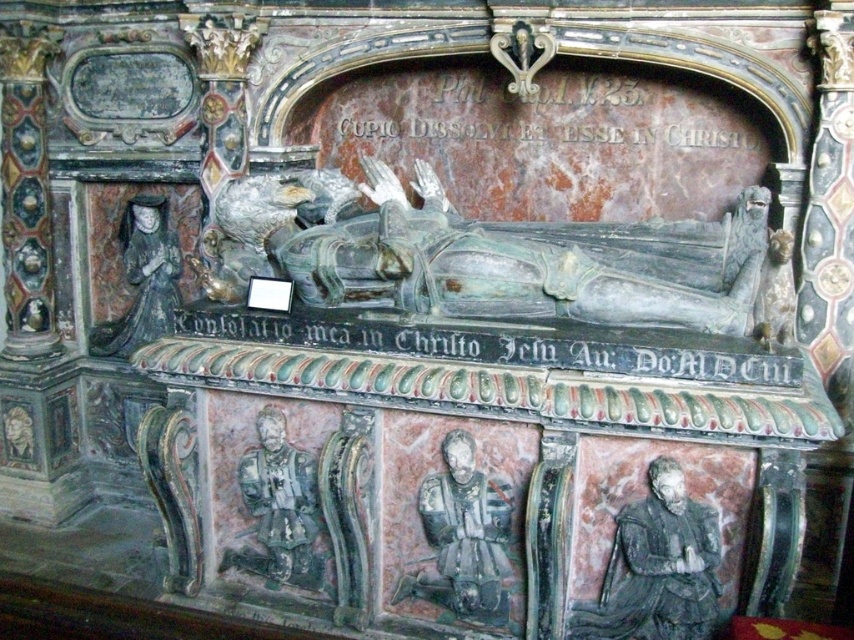
Question: Is green patinated stone figure at center in front of gray stone figure at lower right?

Choices:
 (A) yes
 (B) no

Answer: (B)

Question: Is green patinated stone figure at center in front of gray stone figure at center?

Choices:
 (A) yes
 (B) no

Answer: (B)

Question: Which object appears farthest from the camera in this image?

Choices:
 (A) gray stone figure at center
 (B) gray stone figure at lower right
 (C) green patinated stone figure at center
 (D) gray stone statue at left

Answer: (D)

Question: Which of the following is the farthest from the observer?

Choices:
 (A) (460, 305)
 (B) (278, 550)
 (C) (657, 550)
 (D) (118, 237)

Answer: (D)

Question: Which point is closer to the camera taking this photo?

Choices:
 (A) (746, 314)
 (B) (717, 618)
 (C) (170, 228)

Answer: (B)

Question: Does green patinated stone figure at center have a larger size compared to gray stone figure at center?

Choices:
 (A) no
 (B) yes

Answer: (B)